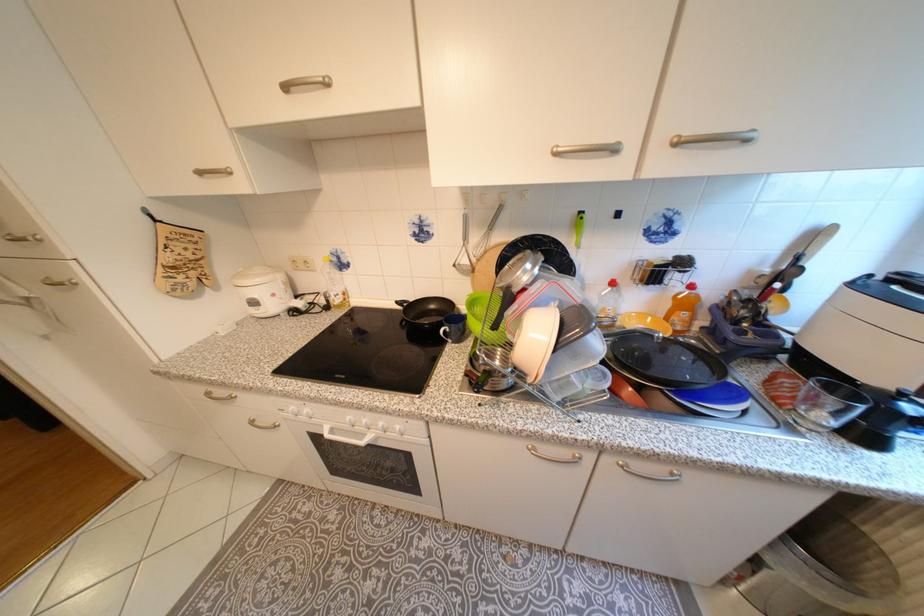
Where would you lift the white rice cooker? Please return your answer as a coordinate pair (x, y).

(262, 290)